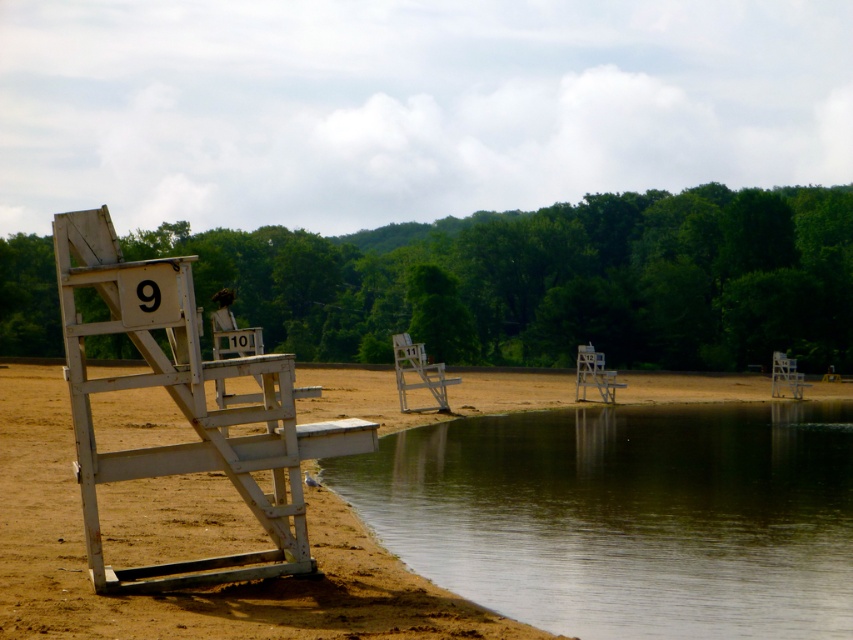
You are standing on the brown sandy beach at lower left and want to reach the clear water at lower center. Which direction should you walk to get there?

You should walk to the right because the clear water at lower center is located to the right of the brown sandy beach at lower left.